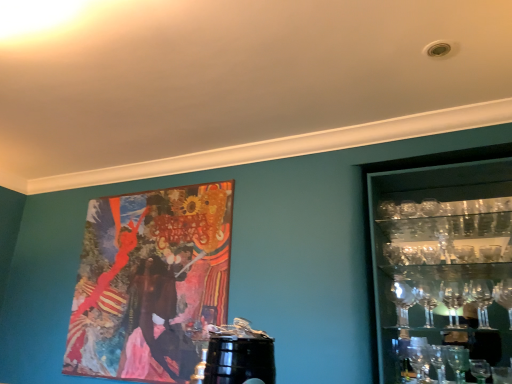
This screenshot has width=512, height=384. Describe the element at coordinates (150, 282) in the screenshot. I see `wooden painting at upper left` at that location.

In order to click on wooden painting at upper left in this screenshot , I will do `click(150, 282)`.

At what (x,y) coordinates should I click in order to perform the action: click on clear glass shelves at right. Please return your answer as a coordinate pair (x, y). Looking at the image, I should click on (442, 258).

Describe the element at coordinates (442, 258) in the screenshot. The height and width of the screenshot is (384, 512). I see `clear glass shelves at right` at that location.

At what (x,y) coordinates should I click in order to perform the action: click on wooden painting at upper left. Please return your answer as a coordinate pair (x, y). This screenshot has height=384, width=512. Looking at the image, I should click on (150, 282).

Considering the relative positions of clear glass shelves at right and wooden painting at upper left in the image provided, is clear glass shelves at right to the right of wooden painting at upper left from the viewer's perspective?

Yes, clear glass shelves at right is to the right of wooden painting at upper left.

Which object is further away from the camera, clear glass shelves at right or wooden painting at upper left?

Positioned behind is wooden painting at upper left.

Is point (499, 308) in front of point (131, 276)?

Yes.

Based on the photo, from the image's perspective, is clear glass shelves at right located above or below wooden painting at upper left?

clear glass shelves at right is situated higher than wooden painting at upper left in the image.

From a real-world perspective, is clear glass shelves at right positioned under wooden painting at upper left based on gravity?

Answer: Yes, from a real-world perspective, clear glass shelves at right is under wooden painting at upper left.

Which object is wider, clear glass shelves at right or wooden painting at upper left?

Wider between the two is clear glass shelves at right.

Is clear glass shelves at right shorter than wooden painting at upper left?

Yes.

Which of these two, clear glass shelves at right or wooden painting at upper left, is smaller?

Smaller between the two is wooden painting at upper left.

Which is correct: clear glass shelves at right is inside wooden painting at upper left, or outside of it?

clear glass shelves at right is not inside wooden painting at upper left, it's outside.

Is there a large distance between clear glass shelves at right and wooden painting at upper left?

That's right, there is a large distance between clear glass shelves at right and wooden painting at upper left.

Is clear glass shelves at right facing away from wooden painting at upper left?

No, clear glass shelves at right is not facing away from wooden painting at upper left.

How many degrees apart are the facing directions of clear glass shelves at right and wooden painting at upper left?

The facing directions of clear glass shelves at right and wooden painting at upper left are 0.81 degrees apart.

Identify the location of shelf above the wooden painting at upper left (from the image's perspective). The width and height of the screenshot is (512, 384). (442, 258).

Considering the relative positions of wooden painting at upper left and clear glass shelves at right in the image provided, is wooden painting at upper left to the left or to the right of clear glass shelves at right?

Clearly, wooden painting at upper left is on the left of clear glass shelves at right in the image.

Considering their positions, is wooden painting at upper left located in front of or behind clear glass shelves at right?

wooden painting at upper left is positioned farther from the viewer than clear glass shelves at right.

Between point (119, 327) and point (393, 290), which one is positioned behind?

The point (119, 327) is behind.

From the image's perspective, is wooden painting at upper left above or below clear glass shelves at right?

wooden painting at upper left is situated lower than clear glass shelves at right in the image.

From a real-world perspective, who is located higher, wooden painting at upper left or clear glass shelves at right?

In real-world perspective, wooden painting at upper left is above.

Looking at this image, which object is wider, wooden painting at upper left or clear glass shelves at right?

Wider between the two is clear glass shelves at right.

Does wooden painting at upper left have a lesser height compared to clear glass shelves at right?

No.

Does wooden painting at upper left have a larger size compared to clear glass shelves at right?

Incorrect, wooden painting at upper left is not larger than clear glass shelves at right.

Which is correct: wooden painting at upper left is inside clear glass shelves at right, or outside of it?

The correct answer is: outside.

Is there a large distance between wooden painting at upper left and clear glass shelves at right?

That's right, there is a large distance between wooden painting at upper left and clear glass shelves at right.

Is wooden painting at upper left aimed at clear glass shelves at right?

No, wooden painting at upper left is not aimed at clear glass shelves at right.

Can you tell me how much wooden painting at upper left and clear glass shelves at right differ in facing direction?

The angle between the facing direction of wooden painting at upper left and the facing direction of clear glass shelves at right is 0.81 degrees.

Find the location of a particular element. The height and width of the screenshot is (384, 512). shelf that is in front of the wooden painting at upper left is located at coordinates [442, 258].

Find the location of `shelf in front of the wooden painting at upper left`. shelf in front of the wooden painting at upper left is located at coordinates pyautogui.click(x=442, y=258).

Where is `picture frame behind the clear glass shelves at right`? The height and width of the screenshot is (384, 512). picture frame behind the clear glass shelves at right is located at coordinates (150, 282).